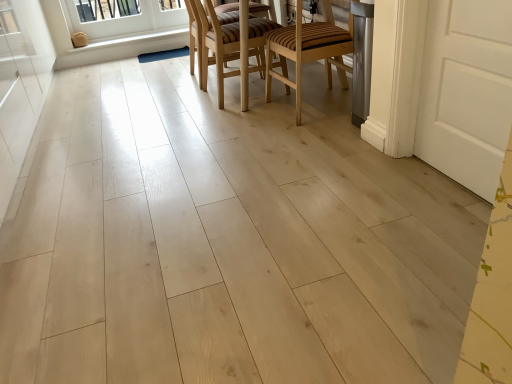
Question: From their relative heights in the image, would you say white wood window at upper left is taller or shorter than wooden striped chair at center, which is the 2th chair in left-to-right order?

Choices:
 (A) short
 (B) tall

Answer: (A)

Question: Is white wood window at upper left in front of or behind wooden striped chair at center, which ranks as the 1th chair in right-to-left order, in the image?

Choices:
 (A) behind
 (B) front

Answer: (A)

Question: Estimate the real-world distances between objects in this image. Which object is closer to the wooden striped chair at center, which ranks as the 1th chair in right-to-left order?

Choices:
 (A) wooden chair at center, which is the 2th chair from right to left
 (B) white painted wood at upper left
 (C) white wood window at upper left
 (D) white wood screen door at left

Answer: (A)

Question: Which object is the closest to the white painted wood at upper left?

Choices:
 (A) white wood screen door at left
 (B) wooden chair at center, which is the first chair in left-to-right order
 (C) white wood window at upper left
 (D) wooden striped chair at center, which ranks as the 1th chair in right-to-left order

Answer: (C)